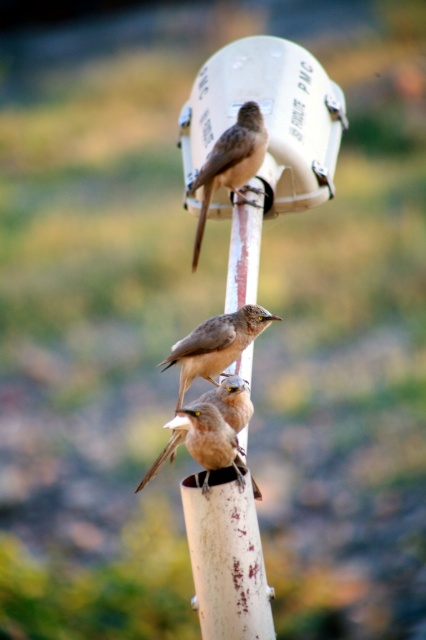
Can you confirm if white matte bird feeder at upper center is positioned above brown feathered bird at center?

Answer: Yes.

Find the location of `white matte bird feeder at upper center`. white matte bird feeder at upper center is located at coordinates (270, 116).

Is point (276, 65) more distant than point (221, 337)?

Yes, point (276, 65) is farther from viewer.

The height and width of the screenshot is (640, 426). In order to click on white matte bird feeder at upper center in this screenshot , I will do `click(270, 116)`.

Who is more forward, (238, 49) or (215, 435)?

Point (215, 435)

Looking at this image, which is more to the left, white matte bird feeder at upper center or brown matte bird at lower center?

From the viewer's perspective, brown matte bird at lower center appears more on the left side.

Is point (324, 90) closer to viewer compared to point (221, 429)?

No.

This screenshot has height=640, width=426. I want to click on white matte bird feeder at upper center, so (x=270, y=116).

Does brown matte bird at upper center appear under brown feathered bird at center?

Incorrect, brown matte bird at upper center is not positioned below brown feathered bird at center.

Who is taller, brown matte bird at upper center or brown feathered bird at center?

brown matte bird at upper center

You are a GUI agent. You are given a task and a screenshot of the screen. Output one action in this format:
    pyautogui.click(x=<x>, y=<y>)
    Task: Click on the brown matte bird at upper center
    The image size is (426, 640).
    Given the screenshot: What is the action you would take?
    pyautogui.click(x=230, y=164)